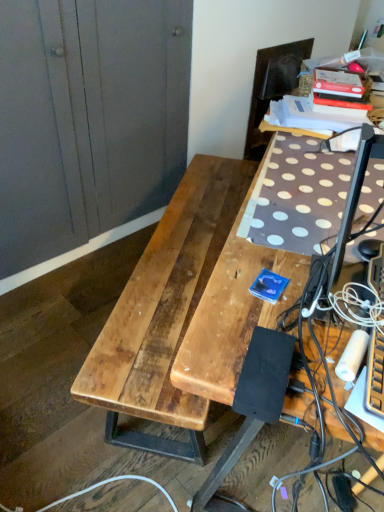
The image size is (384, 512). Find the location of `vacant area on top of brown wooden desk at center (from a real-world perspective)`. vacant area on top of brown wooden desk at center (from a real-world perspective) is located at coordinates (316, 197).